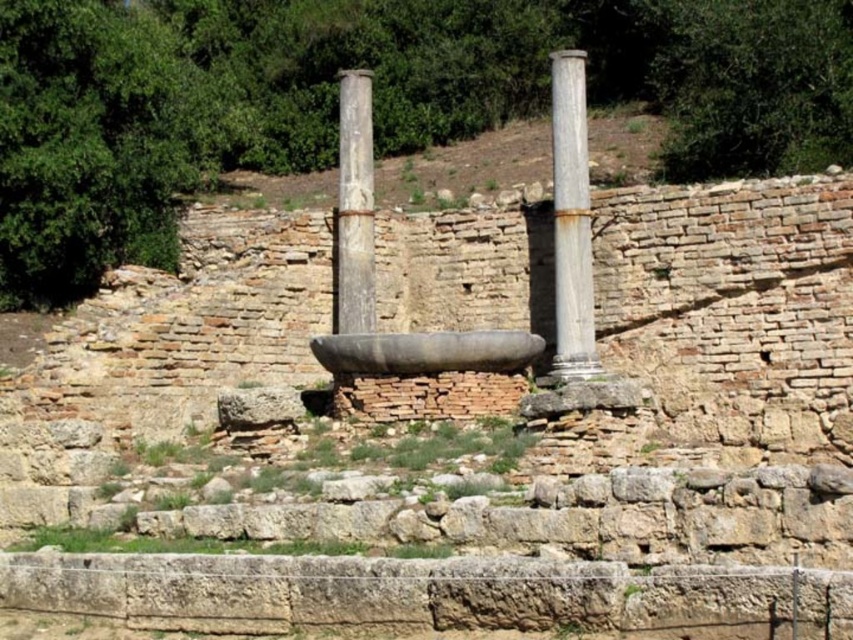
Does rusty metallic column at right have a larger size compared to smooth stone column at center?

Incorrect, rusty metallic column at right is not larger than smooth stone column at center.

Based on the photo, is rusty metallic column at right below smooth stone column at center?

Correct, rusty metallic column at right is located below smooth stone column at center.

Does point (572, 128) come closer to viewer compared to point (345, 116)?

Yes, point (572, 128) is in front of point (345, 116).

The image size is (853, 640). What are the coordinates of `rusty metallic column at right` in the screenshot? It's located at (572, 221).